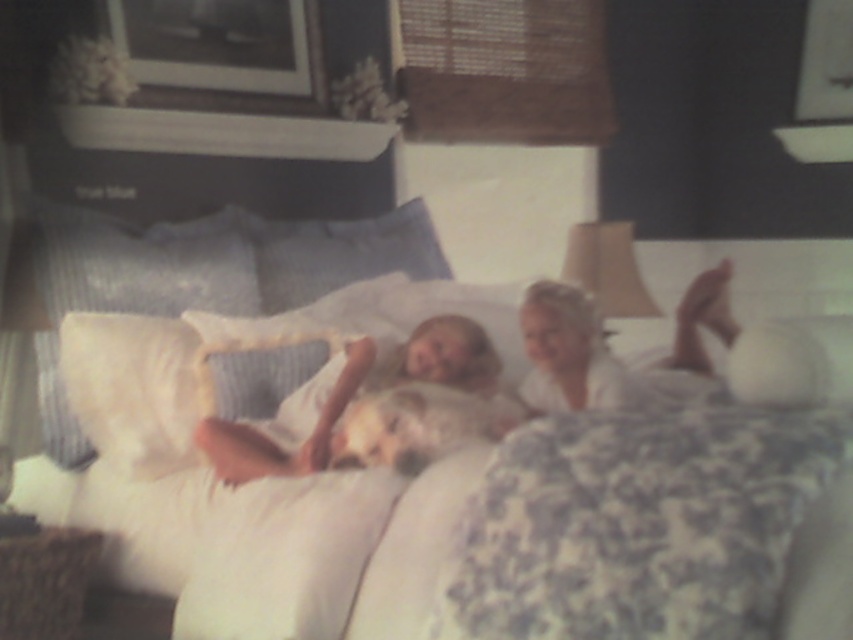
What is the location of the point with coordinates (375, 410) in the image?

The point with coordinates (375, 410) is located on the white soft fabric at center.

You are a parent trying to reach the white soft fabric at center from where you are standing. Can you grab it without moving your feet?

The white soft fabric at center and viewer are 6.11 feet apart from each other, so you can reach it without moving your feet if your arm span is at least 6.11 feet. However, the average adult arm span is typically shorter than that, so it might be difficult unless you can extend your arm fully.

You are a photographer taking a picture of the two children on the bed. You notice two points marked in the scene. Which point is closer to your camera lens? The options are point (74, 211) and point (541, 381).

Point (74, 211) is further to the camera than point (541, 381), so the point closer to the camera lens is point (74, 211).